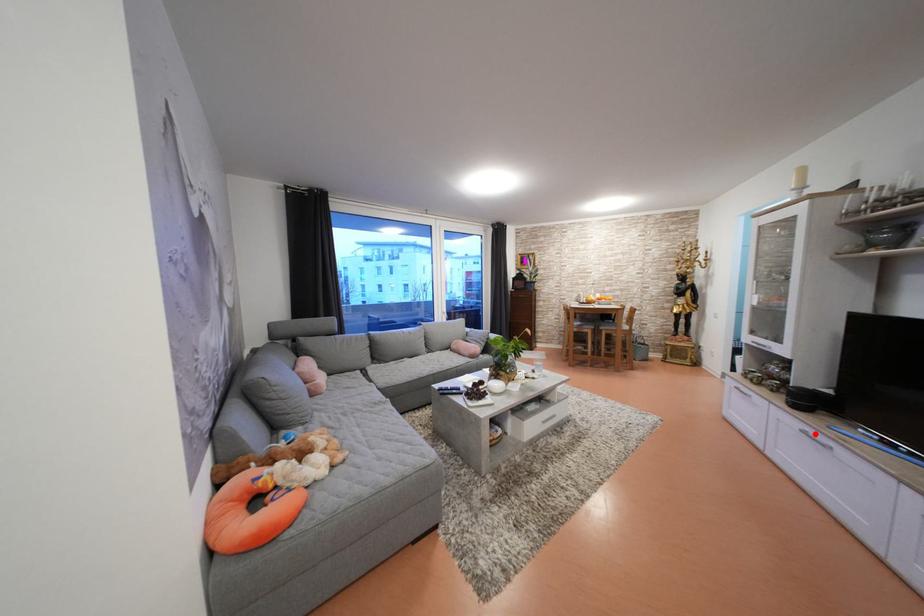
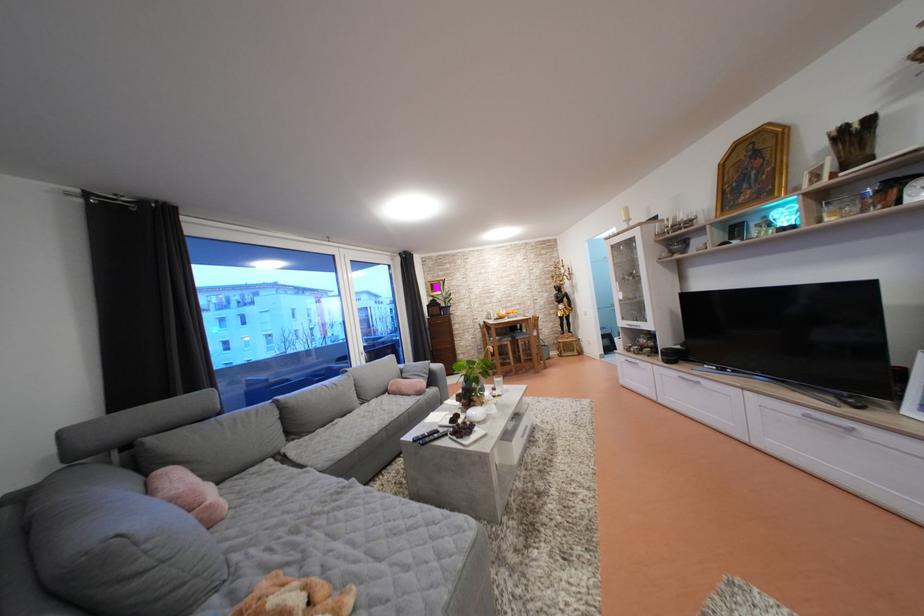
Where in the second image is the point corresponding to the highlighted location from the first image?

(688, 379)